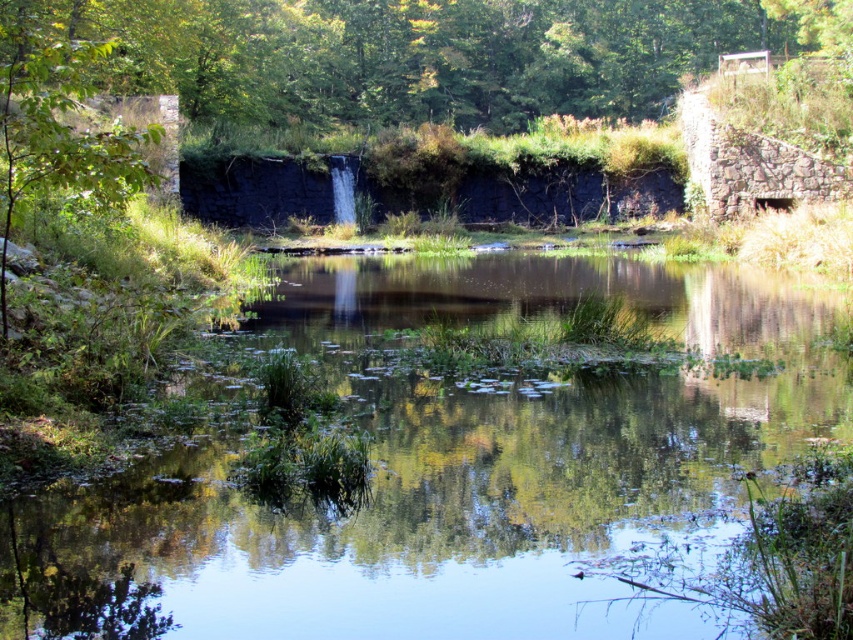
Question: Does clear water at center have a larger size compared to green leafy tree at upper center?

Choices:
 (A) yes
 (B) no

Answer: (B)

Question: Which point appears closest to the camera in this image?

Choices:
 (A) (0, 20)
 (B) (467, 100)
 (C) (199, 518)

Answer: (C)

Question: Observing the image, what is the correct spatial positioning of clear water at center in reference to green leafy tree at upper left?

Choices:
 (A) above
 (B) below

Answer: (B)

Question: Estimate the real-world distances between objects in this image. Which object is farther from the green leafy tree at upper left?

Choices:
 (A) clear water at center
 (B) green leafy tree at upper center

Answer: (B)

Question: Estimate the real-world distances between objects in this image. Which object is closer to the green leafy tree at upper center?

Choices:
 (A) clear water at center
 (B) green leafy tree at upper left

Answer: (B)

Question: Does green leafy tree at upper center appear on the left side of green leafy tree at upper left?

Choices:
 (A) no
 (B) yes

Answer: (A)